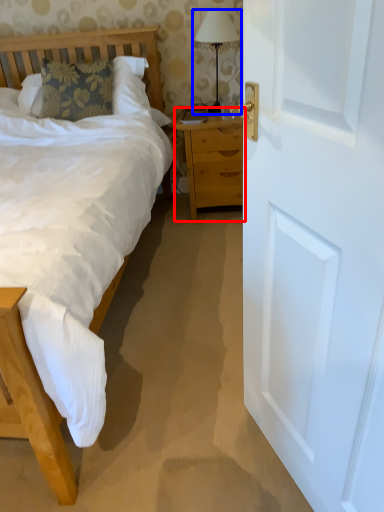
Question: Which object is closer to the camera taking this photo, nightstand (highlighted by a red box) or bedside lamp (highlighted by a blue box)?

Choices:
 (A) nightstand
 (B) bedside lamp

Answer: (B)